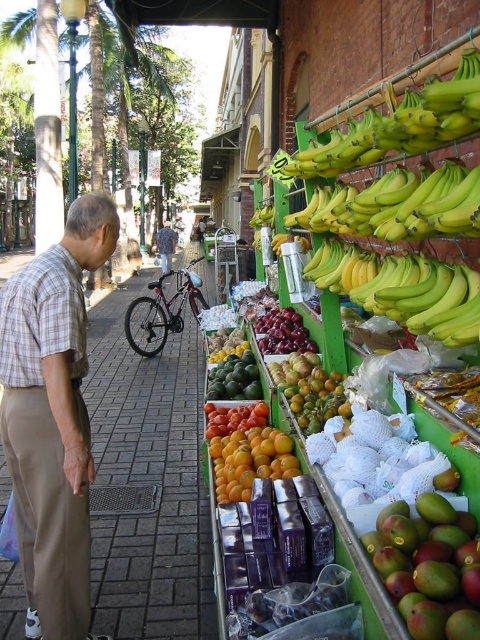
You are a customer at the market and want to buy a fruit that is larger in size between the green matte mango at lower right and the shiny red tomatoes at center. Which one should you choose?

The shiny red tomatoes at center are larger than the green matte mango at lower right, so you should choose the shiny red tomatoes at center.

You are a customer at the market and want to buy the green matte mango at lower right. The vendor says it is located at coordinates point (x=429, y=566). Can you confirm the location of the green matte mango at lower right based on the vendor coordinates?

The point (x=429, y=566) marks the green matte mango at lower right, so yes, the vendor is correct in stating its location at those coordinates.